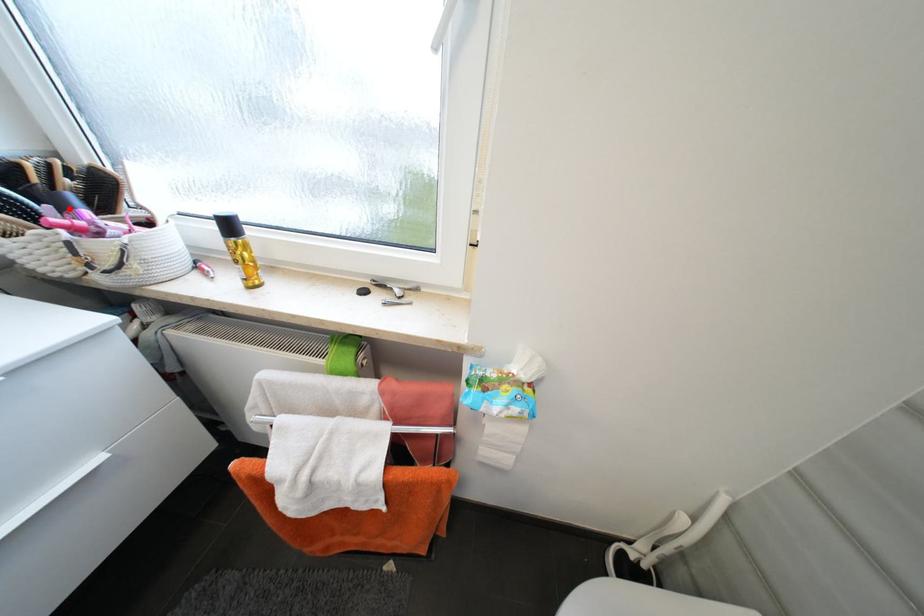
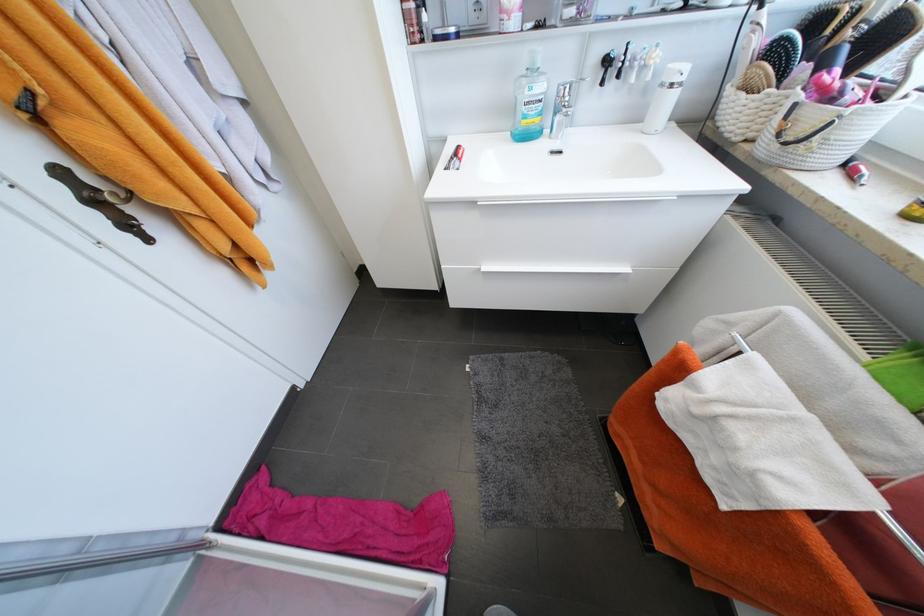
Where in the second image is the point corresponding to the highlighted location from the first image?

(829, 66)